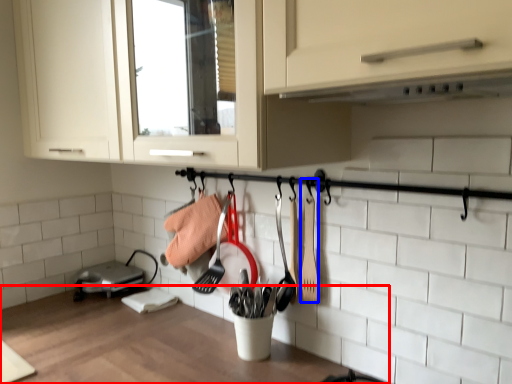
Question: Which of the following is the closest to the observer, countertop (highlighted by a red box) or spatula (highlighted by a blue box)?

Choices:
 (A) countertop
 (B) spatula

Answer: (A)